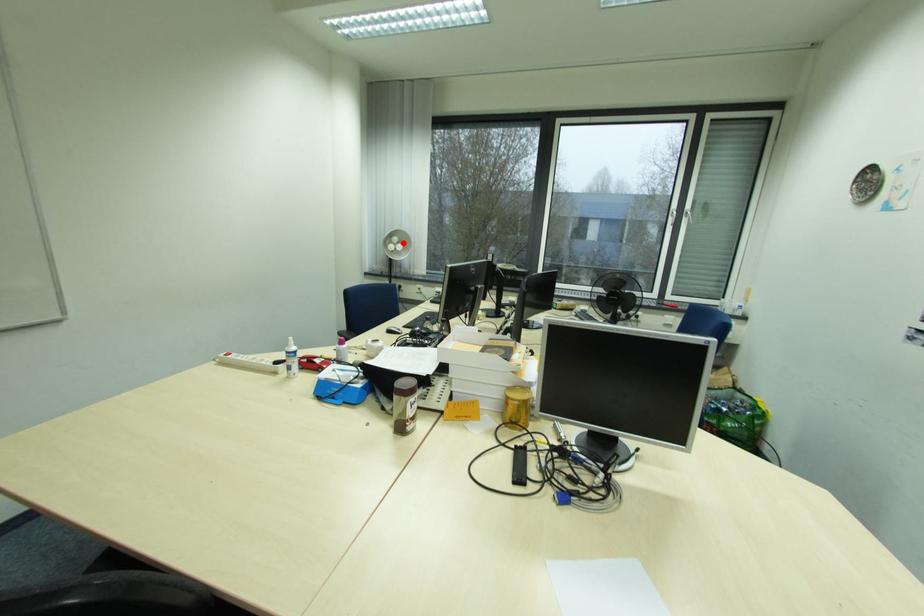
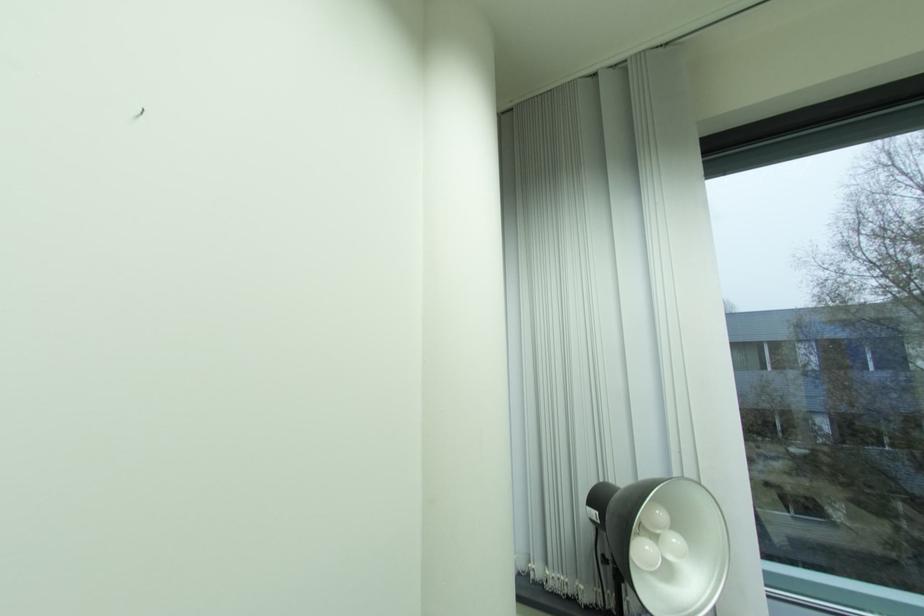
Question: I am providing you with two images of the same scene from different viewpoints. A red point is shown in image1. For the corresponding object point in image2, is it positioned nearer or farther from the camera?

Choices:
 (A) Nearer
 (B) Farther

Answer: (B)